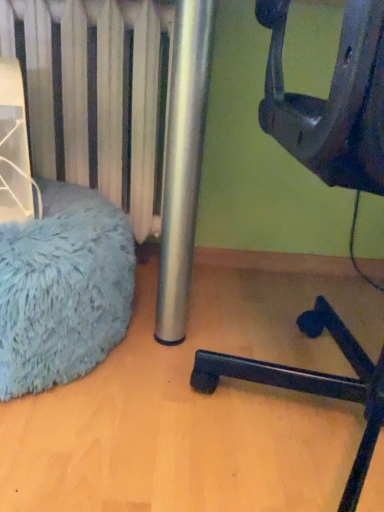
Question: Based on their sizes in the image, would you say blue fuzzy bean bag at left is bigger or smaller than black plastic chair at lower right?

Choices:
 (A) big
 (B) small

Answer: (B)

Question: In terms of width, does blue fuzzy bean bag at left look wider or thinner when compared to black plastic chair at lower right?

Choices:
 (A) thin
 (B) wide

Answer: (A)

Question: From the image's perspective, relative to black plastic chair at lower right, is blue fuzzy bean bag at left above or below?

Choices:
 (A) above
 (B) below

Answer: (B)

Question: Considering the positions of black plastic chair at lower right and blue fuzzy bean bag at left in the image, is black plastic chair at lower right wider or thinner than blue fuzzy bean bag at left?

Choices:
 (A) thin
 (B) wide

Answer: (B)

Question: Based on their sizes in the image, would you say black plastic chair at lower right is bigger or smaller than blue fuzzy bean bag at left?

Choices:
 (A) small
 (B) big

Answer: (B)

Question: From a real-world perspective, is black plastic chair at lower right physically located above or below blue fuzzy bean bag at left?

Choices:
 (A) below
 (B) above

Answer: (B)

Question: Is black plastic chair at lower right taller or shorter than blue fuzzy bean bag at left?

Choices:
 (A) short
 (B) tall

Answer: (B)